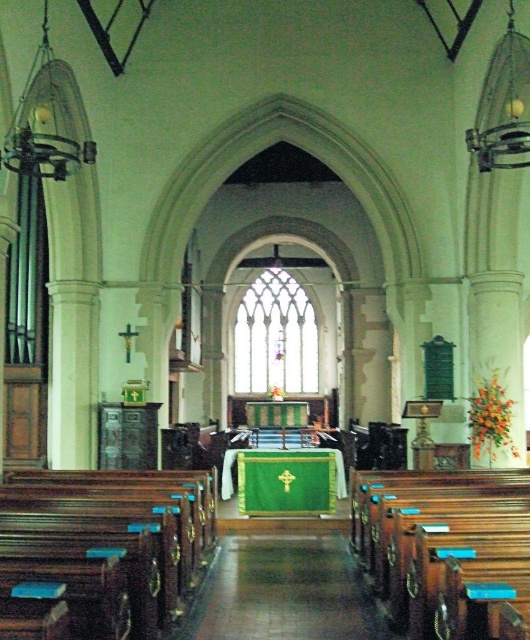
You are a visitor standing in the nave of the church. You notice two sets of pews, the polished dark wood pews at left and the wooden polished pews at lower right. Which set of pews is taller?

The polished dark wood pews at left are taller than the wooden polished pews at lower right.

You are standing in the nave of the church facing the altar. There are polished dark wood pews at left. Based on their position, which direction should you walk to reach the altar?

The polished dark wood pews at left are positioned at coordinates approximately 0.855 on the x axis and 0.202 on the y axis. Since the altar is at the far end of the nave, you should walk forward towards the altar, away from the pews located to your left.